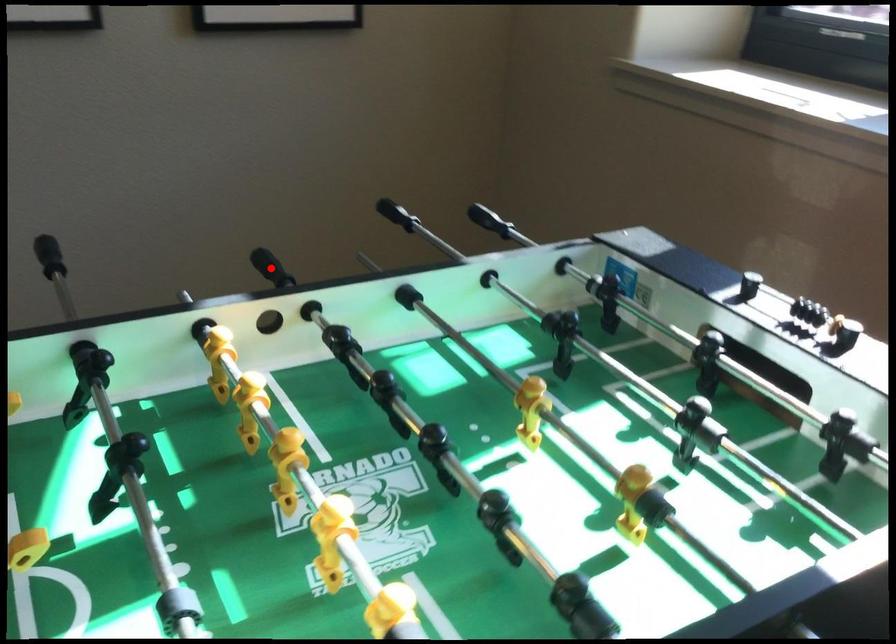
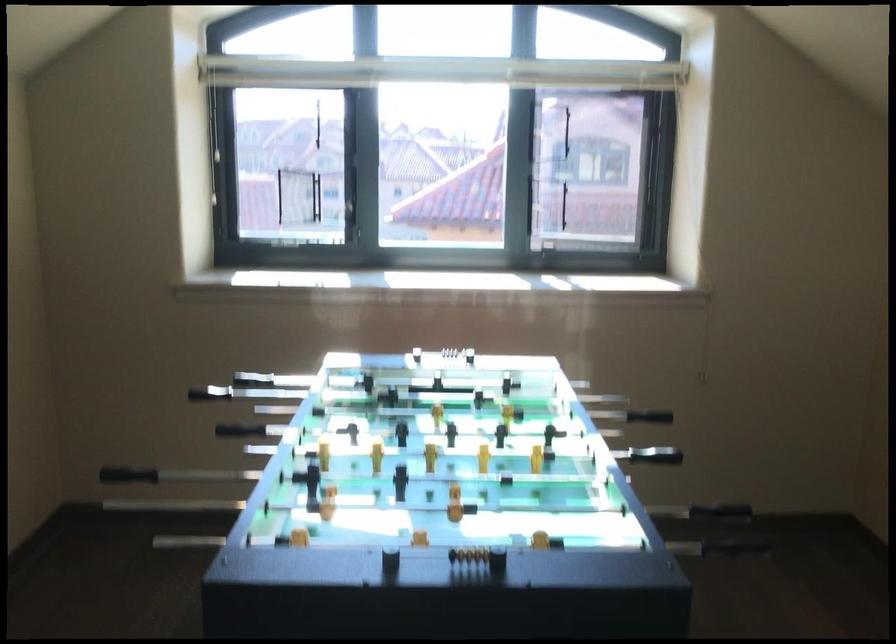
In the second image, find the point that corresponds to the highlighted location in the first image.

(231, 428)